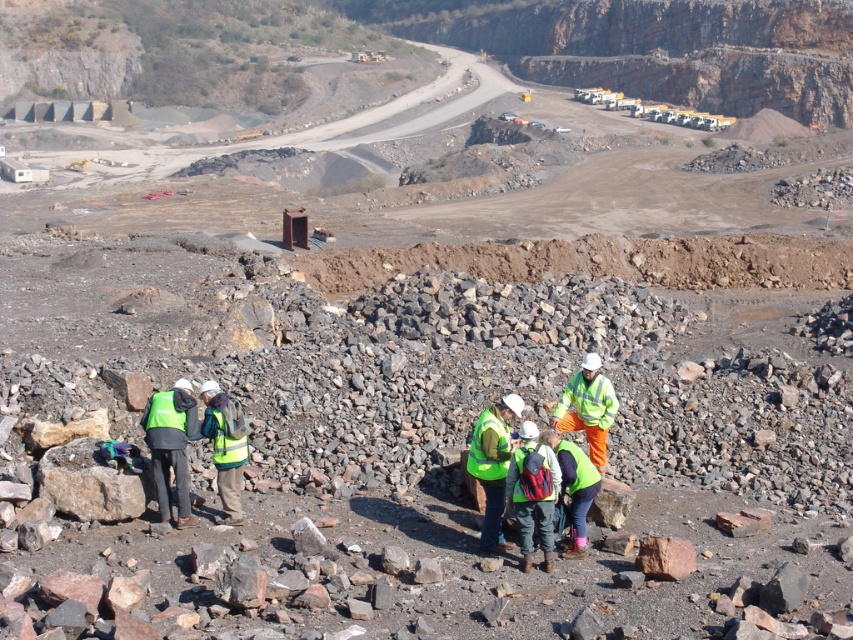
Question: Is high visibility fabric construction worker at center in front of green reflective vest at center?

Choices:
 (A) no
 (B) yes

Answer: (A)

Question: Which object is farther from the camera taking this photo?

Choices:
 (A) green reflective vest at lower left
 (B) green matte safety vest at lower left

Answer: (B)

Question: Which object is closer to the camera taking this photo?

Choices:
 (A) green reflective vest at lower left
 (B) green matte safety vest at lower left
 (C) green matte safety vest at center

Answer: (C)

Question: In this image, where is high visibility fabric construction worker at center located relative to green reflective vest at center?

Choices:
 (A) above
 (B) below

Answer: (A)

Question: Which point is closer to the camera?

Choices:
 (A) high visibility fabric safety vest at center
 (B) high visibility yellow vest at center
 (C) green reflective vest at lower left
 (D) green reflective vest at center

Answer: (B)

Question: Does green matte safety vest at center come behind high visibility fabric safety vest at center?

Choices:
 (A) no
 (B) yes

Answer: (A)